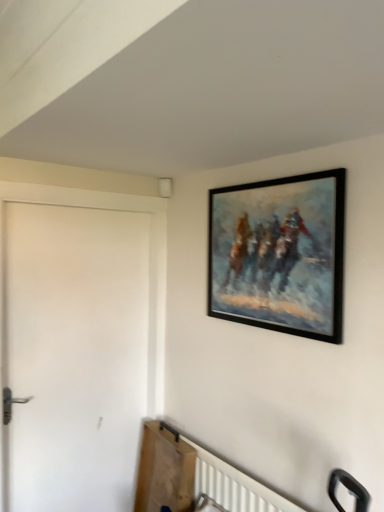
Describe the element at coordinates (76, 354) in the screenshot. I see `white matte door at left` at that location.

Find the location of a particular element. The height and width of the screenshot is (512, 384). white matte door at left is located at coordinates (76, 354).

Measure the distance between point (113, 303) and camera.

The depth of point (113, 303) is 7.26 feet.

At what (x,y) coordinates should I click in order to perform the action: click on black matte picture frame at upper right. Please return your answer as a coordinate pair (x, y). The width and height of the screenshot is (384, 512). Looking at the image, I should click on (280, 254).

Describe the element at coordinates (280, 254) in the screenshot. I see `black matte picture frame at upper right` at that location.

Where is `white matte door at left`? The image size is (384, 512). white matte door at left is located at coordinates (76, 354).

Which is more to the left, white matte door at left or black matte picture frame at upper right?

white matte door at left is more to the left.

Which object is closer to the camera, white matte door at left or black matte picture frame at upper right?

black matte picture frame at upper right is in front.

Which is behind, point (90, 351) or point (250, 259)?

The point (90, 351) is farther.

From the image's perspective, would you say white matte door at left is shown under black matte picture frame at upper right?

Correct, white matte door at left appears lower than black matte picture frame at upper right in the image.

From a real-world perspective, which is physically above, white matte door at left or black matte picture frame at upper right?

From a 3D spatial view, black matte picture frame at upper right is above.

Which of these two, white matte door at left or black matte picture frame at upper right, is thinner?

Thinner between the two is black matte picture frame at upper right.

Does white matte door at left have a lesser height compared to black matte picture frame at upper right?

Incorrect, the height of white matte door at left does not fall short of that of black matte picture frame at upper right.

Who is smaller, white matte door at left or black matte picture frame at upper right?

black matte picture frame at upper right.

Based on the photo, is white matte door at left inside or outside of black matte picture frame at upper right?

white matte door at left is outside black matte picture frame at upper right.

Can you see white matte door at left touching black matte picture frame at upper right?

No, white matte door at left is not making contact with black matte picture frame at upper right.

Is black matte picture frame at upper right at the back of white matte door at left?

white matte door at left does not have its back to black matte picture frame at upper right.

This screenshot has width=384, height=512. What are the coordinates of `door located on the left of black matte picture frame at upper right` in the screenshot? It's located at (76, 354).

Is black matte picture frame at upper right to the left or to the right of white matte door at left in the image?

From the image, it's evident that black matte picture frame at upper right is to the right of white matte door at left.

Which object is closer to the camera taking this photo, black matte picture frame at upper right or white matte door at left?

Positioned in front is black matte picture frame at upper right.

Between point (251, 223) and point (11, 289), which one is positioned in front?

The point (251, 223) is closer.

From the image's perspective, which one is positioned higher, black matte picture frame at upper right or white matte door at left?

black matte picture frame at upper right, from the image's perspective.

From a real-world perspective, is black matte picture frame at upper right positioned under white matte door at left based on gravity?

No.

Between black matte picture frame at upper right and white matte door at left, which one has smaller width?

black matte picture frame at upper right is thinner.

Is black matte picture frame at upper right shorter than white matte door at left?

Indeed, black matte picture frame at upper right has a lesser height compared to white matte door at left.

Who is bigger, black matte picture frame at upper right or white matte door at left?

white matte door at left.

Is black matte picture frame at upper right completely or partially outside of white matte door at left?

Yes, black matte picture frame at upper right is located beyond the bounds of white matte door at left.

Is there a large distance between black matte picture frame at upper right and white matte door at left?

No, there isn't a large distance between black matte picture frame at upper right and white matte door at left.

Does black matte picture frame at upper right turn towards white matte door at left?

No, black matte picture frame at upper right is not oriented towards white matte door at left.

How different are the orientations of black matte picture frame at upper right and white matte door at left in degrees?

They differ by 91.2 degrees in their facing directions.

Where is `door located on the left of black matte picture frame at upper right`? The width and height of the screenshot is (384, 512). door located on the left of black matte picture frame at upper right is located at coordinates (76, 354).

Identify the location of picture frame located on the right of white matte door at left. Image resolution: width=384 pixels, height=512 pixels. (280, 254).

Find the location of a particular element. This screenshot has width=384, height=512. door below the black matte picture frame at upper right (from the image's perspective) is located at coordinates (76, 354).